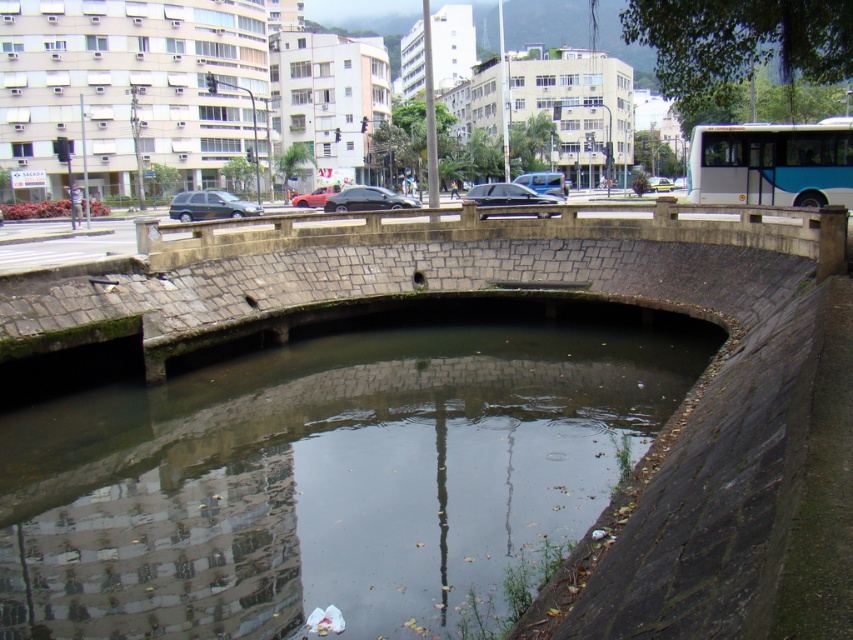
Question: Which of the following is the farthest from the observer?

Choices:
 (A) shiny black car at center
 (B) greenish concrete water at center

Answer: (A)

Question: Which object appears farthest from the camera in this image?

Choices:
 (A) matte red car at center
 (B) white glossy bus at upper right
 (C) shiny black sedan at center

Answer: (A)

Question: Does greenish concrete water at center lie in front of metallic gray suv at center-left?

Choices:
 (A) no
 (B) yes

Answer: (B)

Question: Is shiny black car at center below matte red car at center?

Choices:
 (A) no
 (B) yes

Answer: (B)

Question: Which point is closer to the camera taking this photo?

Choices:
 (A) (245, 209)
 (B) (300, 195)
 (C) (405, 202)
 (D) (3, 214)

Answer: (C)

Question: Can you confirm if greenish concrete water at center is thinner than white glossy bus at upper right?

Choices:
 (A) no
 (B) yes

Answer: (A)